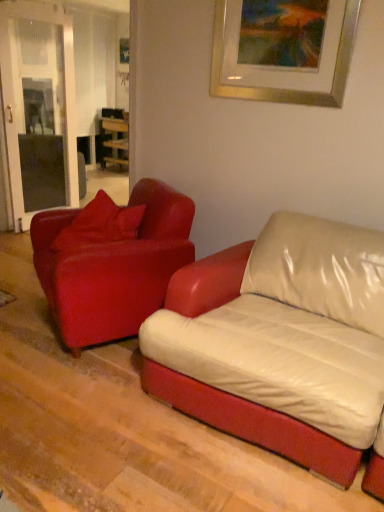
Question: Is matte red leather couch at left, which ranks as the 2th studio couch in left-to-right order, at the back of leather couch at center, placed as the 2th studio couch when sorted from right to left?

Choices:
 (A) no
 (B) yes

Answer: (A)

Question: From a real-world perspective, is leather couch at center, placed as the 2th studio couch when sorted from right to left, beneath matte red leather couch at left, which ranks as the 2th studio couch in left-to-right order?

Choices:
 (A) no
 (B) yes

Answer: (B)

Question: Is matte red leather couch at left, which ranks as the 2th studio couch in left-to-right order, surrounded by leather couch at center, which is the first studio couch in left-to-right order?

Choices:
 (A) no
 (B) yes

Answer: (A)

Question: Is leather couch at center, which is the first studio couch in left-to-right order, not inside matte red leather couch at left, positioned as the first studio couch in right-to-left order?

Choices:
 (A) no
 (B) yes

Answer: (B)

Question: Is leather couch at center, which is the first studio couch in left-to-right order, at the left side of matte red leather couch at left, positioned as the first studio couch in right-to-left order?

Choices:
 (A) yes
 (B) no

Answer: (A)

Question: From a real-world perspective, is leather couch at center, placed as the 2th studio couch when sorted from right to left, on top of matte red leather couch at left, which ranks as the 2th studio couch in left-to-right order?

Choices:
 (A) no
 (B) yes

Answer: (A)

Question: Could you tell me if matte red pillow at left is turned towards wooden table at center?

Choices:
 (A) no
 (B) yes

Answer: (A)

Question: From a real-world perspective, is matte red pillow at left beneath wooden table at center?

Choices:
 (A) yes
 (B) no

Answer: (B)

Question: From the image's perspective, is matte red pillow at left over wooden table at center?

Choices:
 (A) yes
 (B) no

Answer: (B)

Question: Is matte red pillow at left bigger than wooden table at center?

Choices:
 (A) yes
 (B) no

Answer: (B)

Question: Considering the relative sizes of matte red pillow at left and wooden table at center in the image provided, is matte red pillow at left thinner than wooden table at center?

Choices:
 (A) yes
 (B) no

Answer: (A)

Question: Considering the relative positions of matte red pillow at left and wooden table at center in the image provided, is matte red pillow at left to the left of wooden table at center from the viewer's perspective?

Choices:
 (A) yes
 (B) no

Answer: (B)

Question: From a real-world perspective, is gold metallic picture frame at upper center on top of matte red leather couch at left, positioned as the first studio couch in right-to-left order?

Choices:
 (A) no
 (B) yes

Answer: (B)